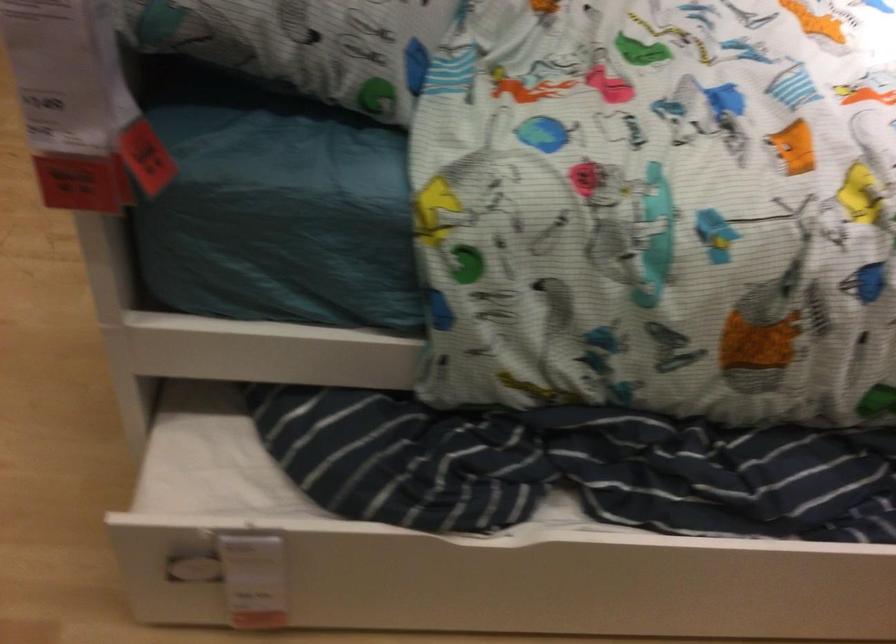
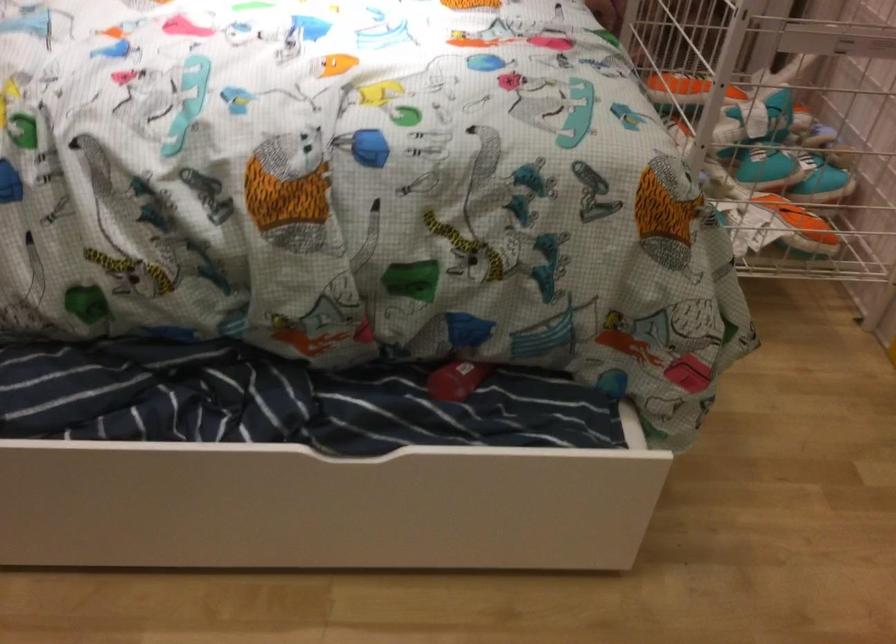
Question: In a continuous first-person perspective shot, in which direction is the camera moving?

Choices:
 (A) Left
 (B) Right
 (C) Forward
 (D) Backward

Answer: (B)